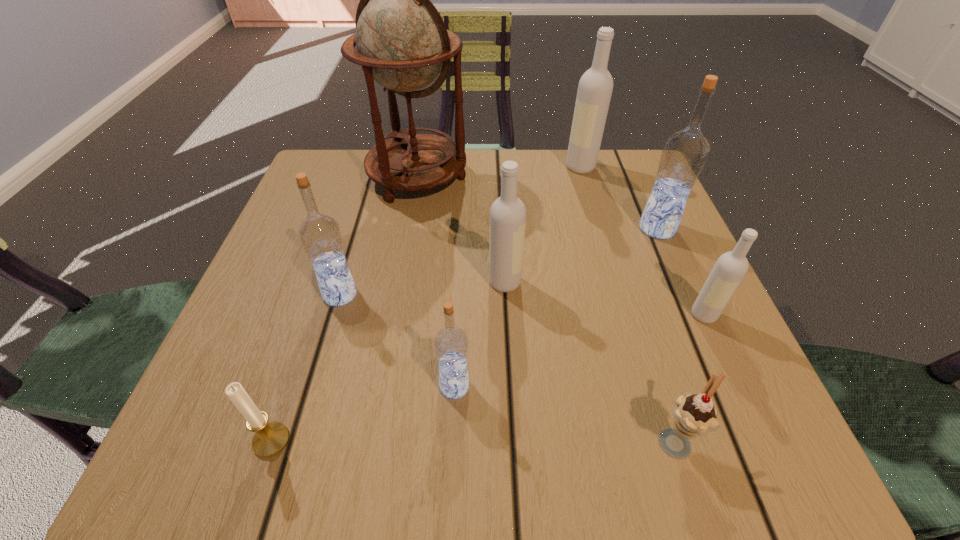
Identify the location of the nearest white vodka. This screenshot has width=960, height=540. (730, 268).

Locate an element on the screen. the nearest blue vodka is located at coordinates (451, 344).

You are a GUI agent. You are given a task and a screenshot of the screen. Output one action in this format:
    pyautogui.click(x=<x>, y=<y>)
    Task: Click on the nearest vodka
    
    Given the screenshot: What is the action you would take?
    pyautogui.click(x=451, y=344)

This screenshot has height=540, width=960. Find the location of `candle holder`. candle holder is located at coordinates (269, 439).

Identify the location of icecream. The image size is (960, 540). (694, 415).

Identify the location of vacant region located on the surface of the tallest object. This screenshot has width=960, height=540. (392, 331).

Identify the location of blank space located 0.210m on the left of the farthest vodka. (476, 167).

Image resolution: width=960 pixels, height=540 pixels. In order to click on vacant area situated 0.320m on the left of the seventh nearest object in this screenshot , I will do `click(479, 228)`.

Identify the location of vacant area situated on the right of the second smallest blue vodka. Image resolution: width=960 pixels, height=540 pixels. (509, 295).

This screenshot has width=960, height=540. Find the location of `vacant space located 0.200m on the right of the fifth object from left to right`. vacant space located 0.200m on the right of the fifth object from left to right is located at coordinates (634, 282).